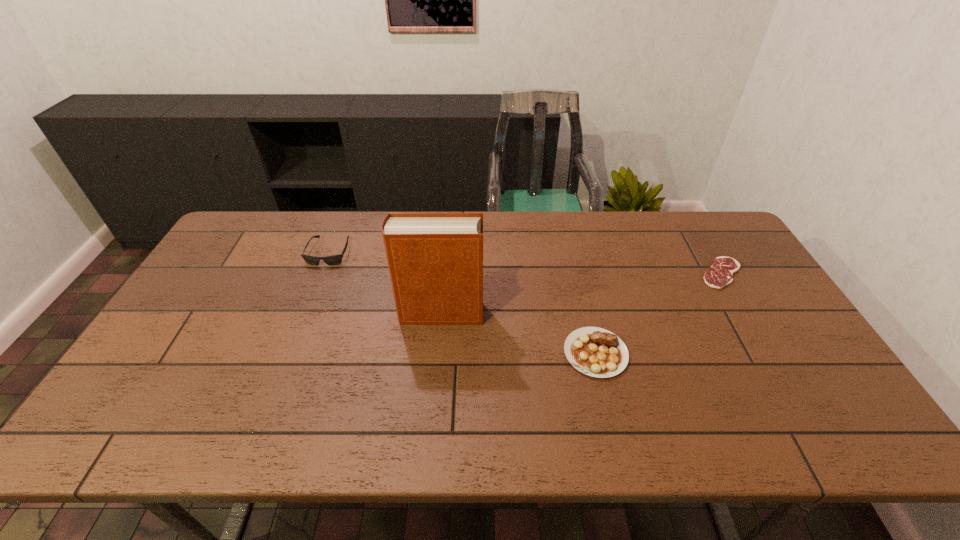
In order to click on free space that satisfies the following two spatial constraints: 1. on the front side of the rightmost object; 2. on the open cover of the second nearest object in this screenshot , I will do `click(745, 313)`.

This screenshot has width=960, height=540. Identify the location of free region that satisfies the following two spatial constraints: 1. on the back side of the nearest object; 2. on the open cover of the second nearest object. (587, 313).